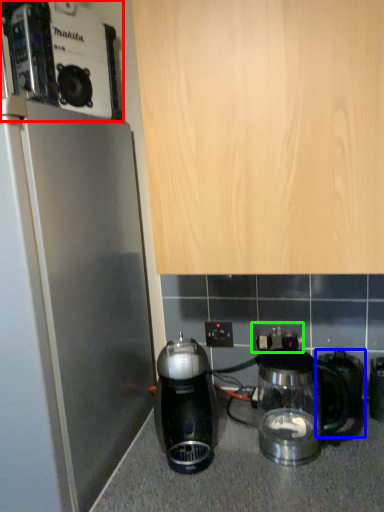
Question: Considering the real-world distances, which object is closest to coffee maker (highlighted by a red box)? coffeepot (highlighted by a blue box) or electric outlet (highlighted by a green box).

Choices:
 (A) coffeepot
 (B) electric outlet

Answer: (B)